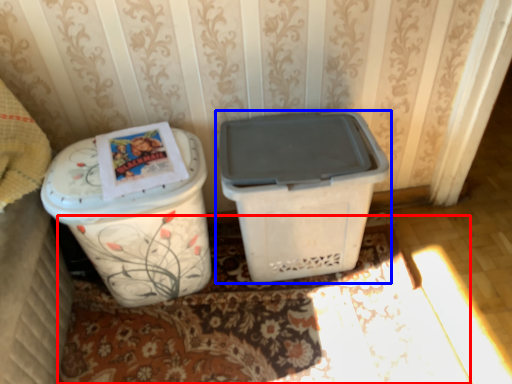
Question: Which of the following is the closest to the observer, doormat (highlighted by a red box) or waste container (highlighted by a blue box)?

Choices:
 (A) doormat
 (B) waste container

Answer: (B)